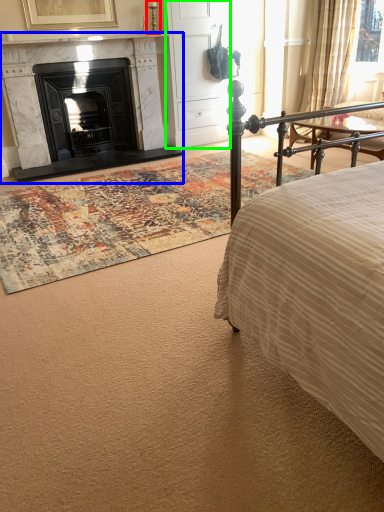
Question: Which is farther away from table lamp (highlighted by a red box)? fireplace (highlighted by a blue box) or armoire (highlighted by a green box)?

Choices:
 (A) fireplace
 (B) armoire

Answer: (A)